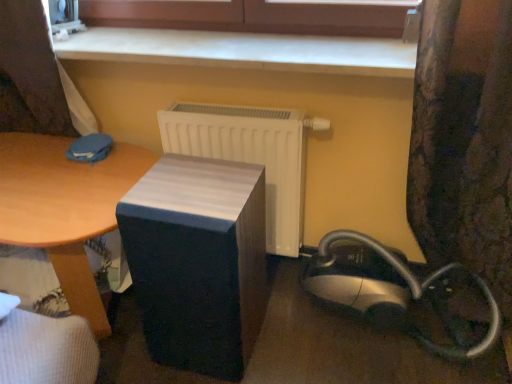
Identify the location of free spot to the right of matte black speaker at center. (288, 339).